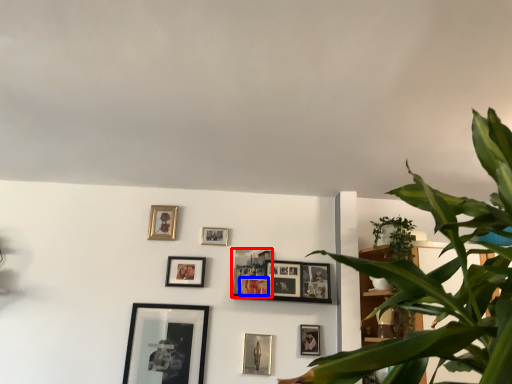
Question: Which object is further to the camera taking this photo, picture frame (highlighted by a red box) or picture frame (highlighted by a blue box)?

Choices:
 (A) picture frame
 (B) picture frame

Answer: (A)